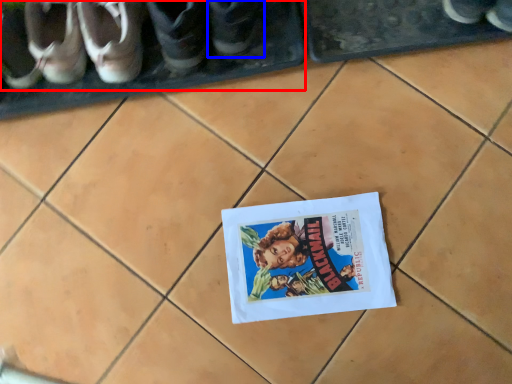
Question: Which object is closer to the camera taking this photo, footwear (highlighted by a red box) or footwear (highlighted by a blue box)?

Choices:
 (A) footwear
 (B) footwear

Answer: (B)